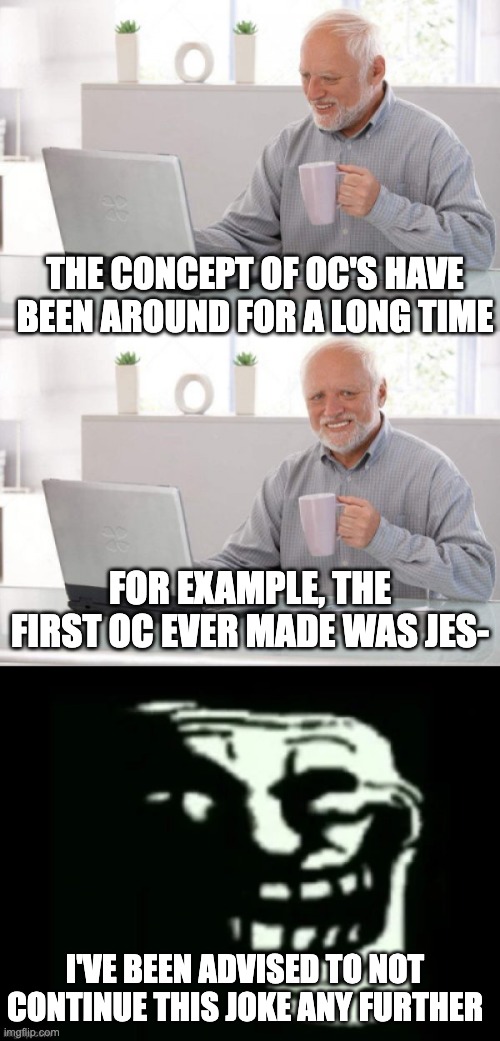
The image size is (500, 1041). What are the coordinates of `plant decoration` in the screenshot? It's located at (129, 50), (243, 384), (123, 376), (238, 47).